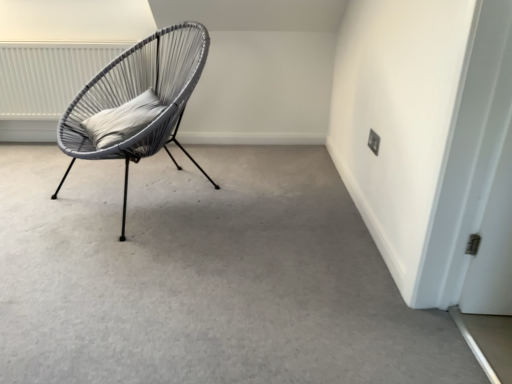
Find the location of a particular element. This screenshot has height=384, width=512. free point to the right of matte grey wicker chair at left is located at coordinates pos(269,201).